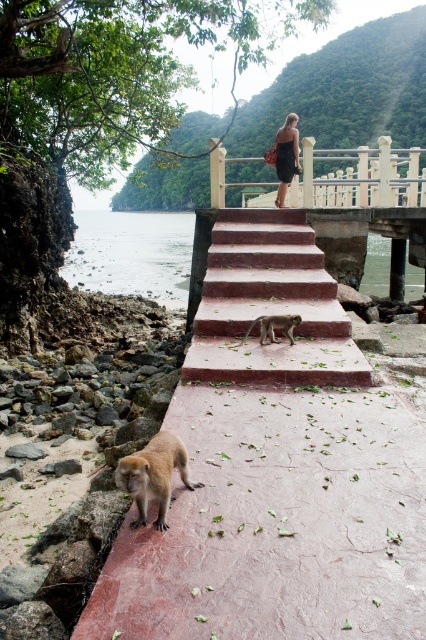
Question: Is smooth concrete stairs at center positioned behind brown furry monkey at center?

Choices:
 (A) yes
 (B) no

Answer: (A)

Question: Is smooth concrete stairs at center further to camera compared to black dress at upper center?

Choices:
 (A) no
 (B) yes

Answer: (A)

Question: Which object appears closest to the camera in this image?

Choices:
 (A) clear water at lower left
 (B) smooth concrete stairs at center
 (C) golden fur monkey at lower left

Answer: (C)

Question: Is clear water at lower left behind brown furry monkey at center?

Choices:
 (A) yes
 (B) no

Answer: (A)

Question: Which point is closer to the camera?

Choices:
 (A) (224, 342)
 (B) (100, 225)

Answer: (A)

Question: Which of the following is the closest to the observer?

Choices:
 (A) brown furry monkey at center
 (B) smooth concrete stairs at center
 (C) golden fur monkey at lower left
 (D) black dress at upper center

Answer: (C)